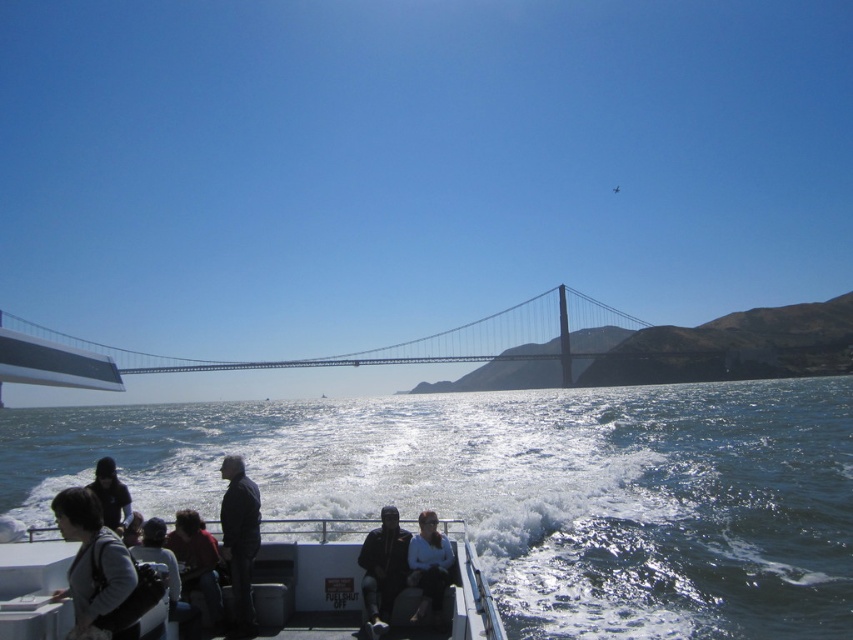
Does point (363, 545) lie in front of point (112, 524)?

Yes, it is.

Which is behind, point (370, 582) or point (97, 465)?

The point (97, 465) is behind.

Where is `dark blue leather jacket at center`? dark blue leather jacket at center is located at coordinates (381, 570).

What do you see at coordinates (526, 490) in the screenshot?
I see `clear blue water at lower center` at bounding box center [526, 490].

Is point (636, 435) positioned behind point (184, 593)?

Yes, it is behind point (184, 593).

Find the location of a particular element. Image resolution: width=853 pixels, height=640 pixels. clear blue water at lower center is located at coordinates (526, 490).

Locate an element on the screen. The image size is (853, 640). clear blue water at lower center is located at coordinates (526, 490).

Is gray fabric jacket at lower left taller than matte black jacket at lower left?

Correct, gray fabric jacket at lower left is much taller as matte black jacket at lower left.

You are a GUI agent. You are given a task and a screenshot of the screen. Output one action in this format:
    pyautogui.click(x=<x>, y=<y>)
    Task: Click on the gray fabric jacket at lower left
    This screenshot has height=640, width=853.
    Given the screenshot: What is the action you would take?
    pyautogui.click(x=91, y=560)

Describe the element at coordinates (91, 560) in the screenshot. I see `gray fabric jacket at lower left` at that location.

Find the location of a particular element. The height and width of the screenshot is (640, 853). gray fabric jacket at lower left is located at coordinates (91, 560).